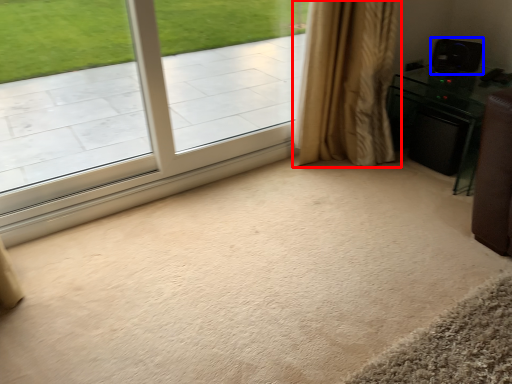
Question: Which object is closer to the camera taking this photo, curtain (highlighted by a red box) or speaker (highlighted by a blue box)?

Choices:
 (A) curtain
 (B) speaker

Answer: (A)